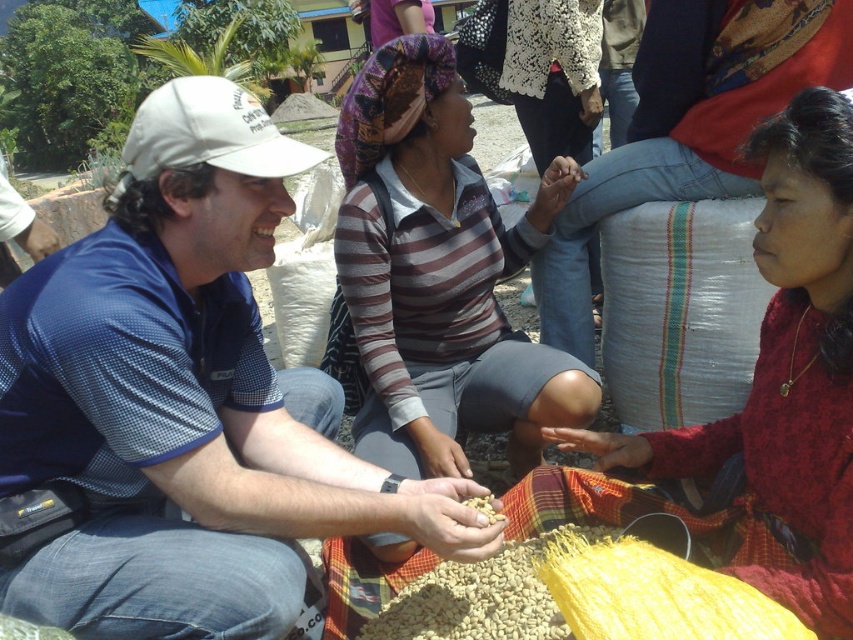
Is blue mesh shirt at center further to the viewer compared to brown matte beans at center?

No, blue mesh shirt at center is in front of brown matte beans at center.

Between blue mesh shirt at center and brown matte beans at center, which one is positioned lower?

brown matte beans at center is below.

Is point (7, 440) farther from camera compared to point (474, 500)?

No, (7, 440) is closer to viewer.

I want to click on blue mesh shirt at center, so click(187, 401).

Can you confirm if blue mesh shirt at center is positioned above striped fabric shirt at center?

Incorrect, blue mesh shirt at center is not positioned above striped fabric shirt at center.

Consider the image. Is blue mesh shirt at center to the right of striped fabric shirt at center from the viewer's perspective?

Incorrect, blue mesh shirt at center is not on the right side of striped fabric shirt at center.

Does point (120, 596) come closer to viewer compared to point (440, 445)?

Yes, point (120, 596) is closer to viewer.

I want to click on blue mesh shirt at center, so click(187, 401).

Does striped fabric shirt at center have a smaller size compared to brown matte beans at center?

Incorrect, striped fabric shirt at center is not smaller in size than brown matte beans at center.

Measure the distance between striped fabric shirt at center and camera.

6.26 feet

What do you see at coordinates (440, 275) in the screenshot? I see `striped fabric shirt at center` at bounding box center [440, 275].

Where is `striped fabric shirt at center`? striped fabric shirt at center is located at coordinates (440, 275).